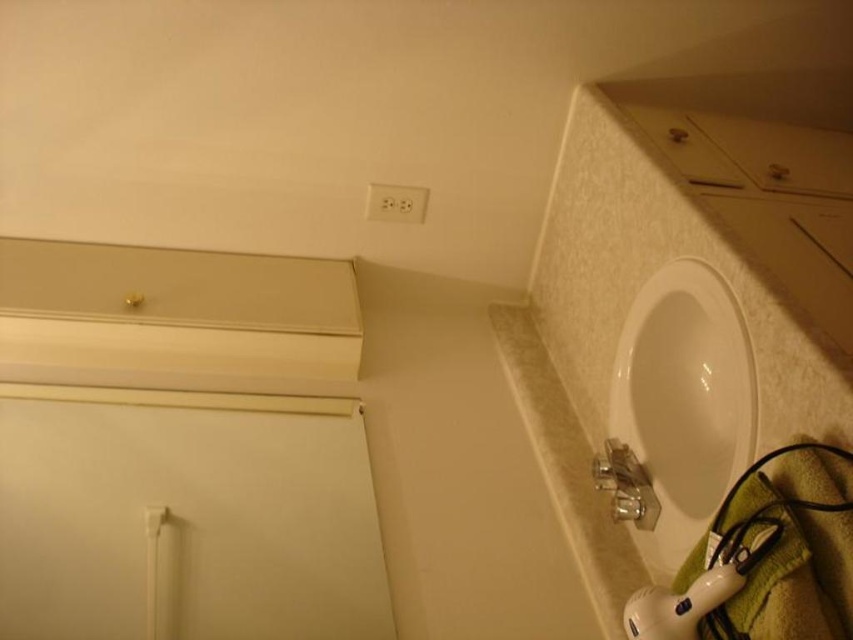
Can you confirm if white glossy sink at lower right is thinner than white plastic outlet at upper center?

In fact, white glossy sink at lower right might be wider than white plastic outlet at upper center.

Which is behind, point (669, 538) or point (386, 186)?

Positioned behind is point (386, 186).

You are a GUI agent. You are given a task and a screenshot of the screen. Output one action in this format:
    pyautogui.click(x=<x>, y=<y>)
    Task: Click on the white glossy sink at lower right
    The height and width of the screenshot is (640, 853).
    Given the screenshot: What is the action you would take?
    683,403